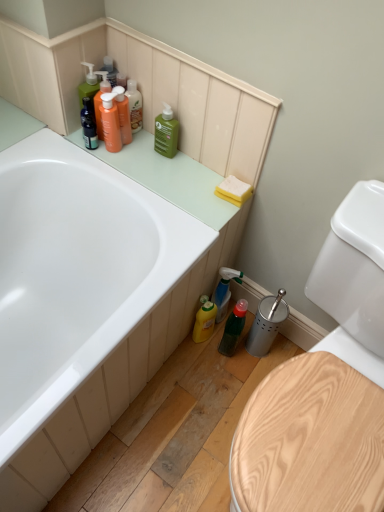
The width and height of the screenshot is (384, 512). Identify the location of free space between yellow sponge at upper right and translucent orange bottles at upper left, arranged as the 1th toiletry when ordered from the bottom. (177, 170).